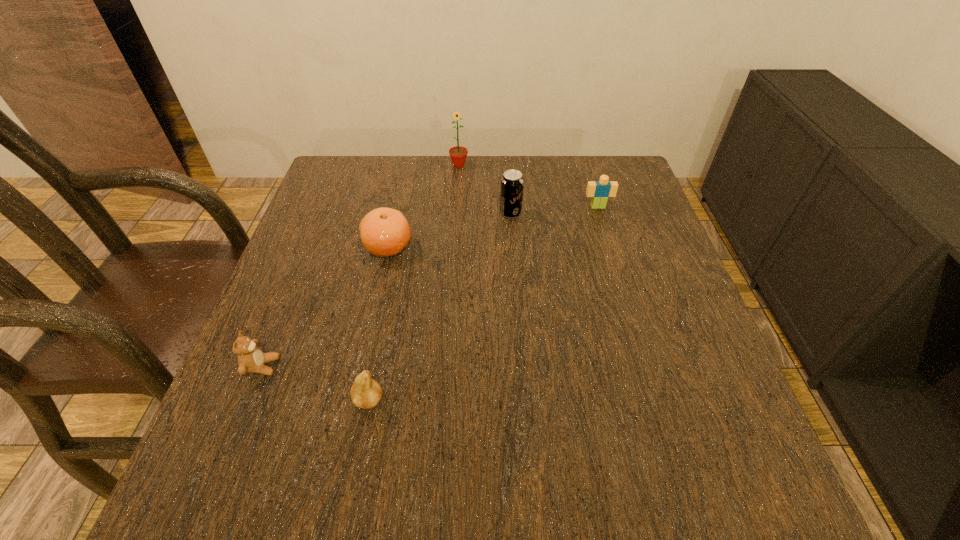
In order to click on sunflower in this screenshot , I will do `click(458, 154)`.

Find the location of `the tallest object`. the tallest object is located at coordinates (458, 154).

At what (x,y) coordinates should I click in order to perform the action: click on the second object from right to left. Please return your answer as a coordinate pair (x, y). The height and width of the screenshot is (540, 960). Looking at the image, I should click on (512, 182).

Image resolution: width=960 pixels, height=540 pixels. Identify the location of soda can. (512, 182).

Locate an element on the screen. the third nearest object is located at coordinates (384, 231).

Where is `Lego`? Lego is located at coordinates (600, 190).

Where is `pear`? The width and height of the screenshot is (960, 540). pear is located at coordinates (366, 393).

This screenshot has width=960, height=540. Find the location of `the fifth farthest object`. the fifth farthest object is located at coordinates (251, 359).

Find the location of a particular element. The width and height of the screenshot is (960, 540). teddy bear is located at coordinates (251, 359).

The width and height of the screenshot is (960, 540). In order to click on vacant space located on the face of the sunflower in this screenshot , I will do `click(456, 214)`.